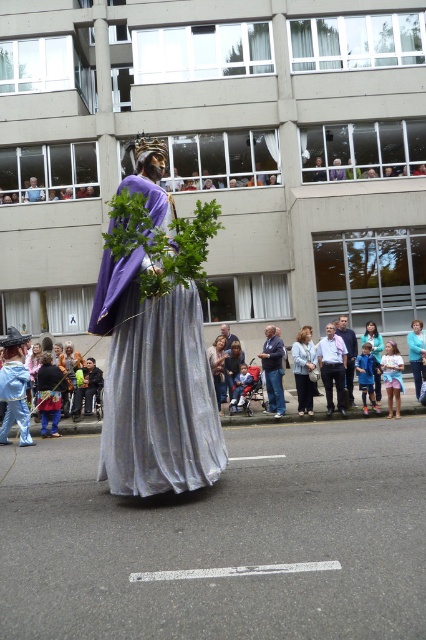
Is silvery metallic dress at center to the right of blue denim jeans at center from the viewer's perspective?

Incorrect, silvery metallic dress at center is not on the right side of blue denim jeans at center.

Does point (184, 340) come behind point (273, 355)?

That is False.

Which is behind, point (201, 344) or point (284, 408)?

Positioned behind is point (284, 408).

The image size is (426, 640). Find the location of `silvery metallic dress at center`. silvery metallic dress at center is located at coordinates (155, 387).

Between point (311, 390) and point (224, 358), which one is positioned in front?

Positioned in front is point (311, 390).

This screenshot has height=640, width=426. Describe the element at coordinates (304, 371) in the screenshot. I see `light blue fabric dress at center` at that location.

Find the location of `light blue fabric dress at center`. light blue fabric dress at center is located at coordinates (304, 371).

Can you confirm if light blue fabric dress at center is wider than light blue denim dress at center?

No, light blue fabric dress at center is not wider than light blue denim dress at center.

Measure the distance between light blue fabric dress at center and camera.

15.31 meters

Image resolution: width=426 pixels, height=640 pixels. I want to click on light blue fabric dress at center, so click(304, 371).